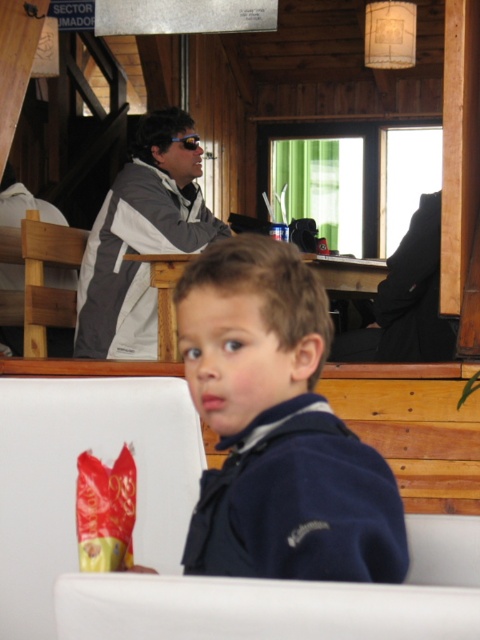
Question: Which point is farther to the camera?

Choices:
 (A) gray/white jacket at upper left
 (B) wooden chair at left
 (C) gray fabric jacket at upper left
 (D) dark blue fleece at center

Answer: (C)

Question: Does dark blue fleece at center have a smaller size compared to gray/white jacket at upper left?

Choices:
 (A) no
 (B) yes

Answer: (B)

Question: Which object is farther from the camera taking this photo?

Choices:
 (A) dark blue fleece at center
 (B) blue reflective lens goggles at upper center
 (C) wooden chair at center

Answer: (B)

Question: Is the position of dark blue fleece at center less distant than that of gray/white jacket at upper left?

Choices:
 (A) yes
 (B) no

Answer: (A)

Question: Does gray/white jacket at upper left have a smaller size compared to blue reflective lens goggles at upper center?

Choices:
 (A) yes
 (B) no

Answer: (B)

Question: Based on their relative distances, which object is nearer to the blue reflective lens goggles at upper center?

Choices:
 (A) gray/white jacket at upper left
 (B) wooden chair at left

Answer: (A)